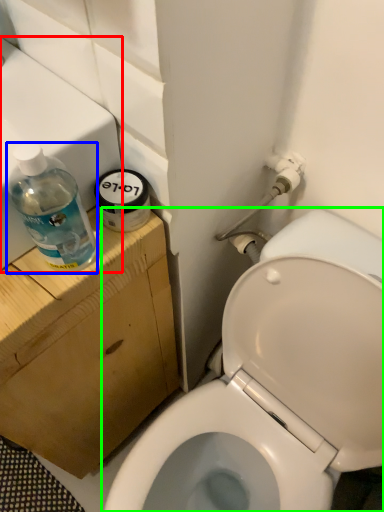
Question: Based on their relative distances, which object is farther from sink (highlighted by a red box)? Choose from bottle (highlighted by a blue box) and toilet (highlighted by a green box).

Choices:
 (A) bottle
 (B) toilet

Answer: (B)